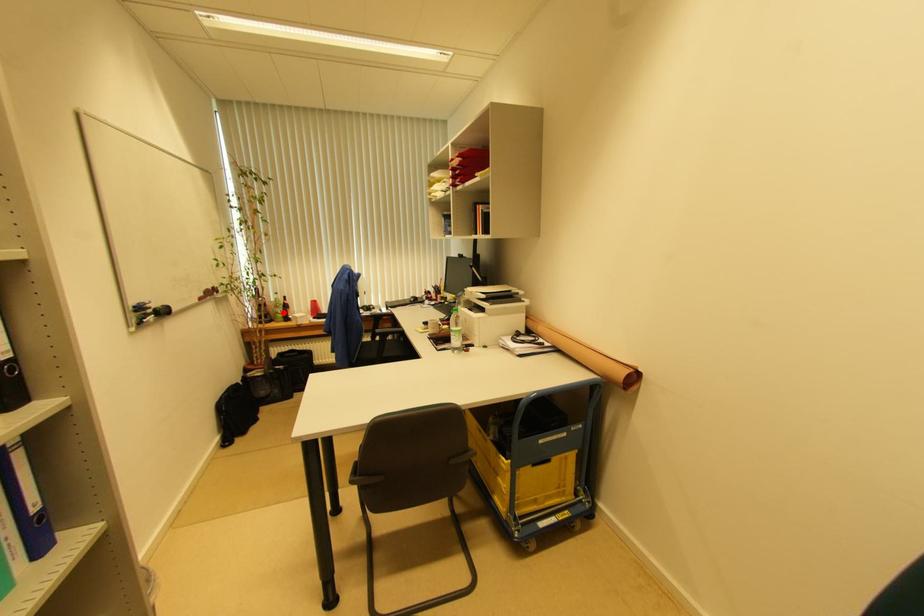
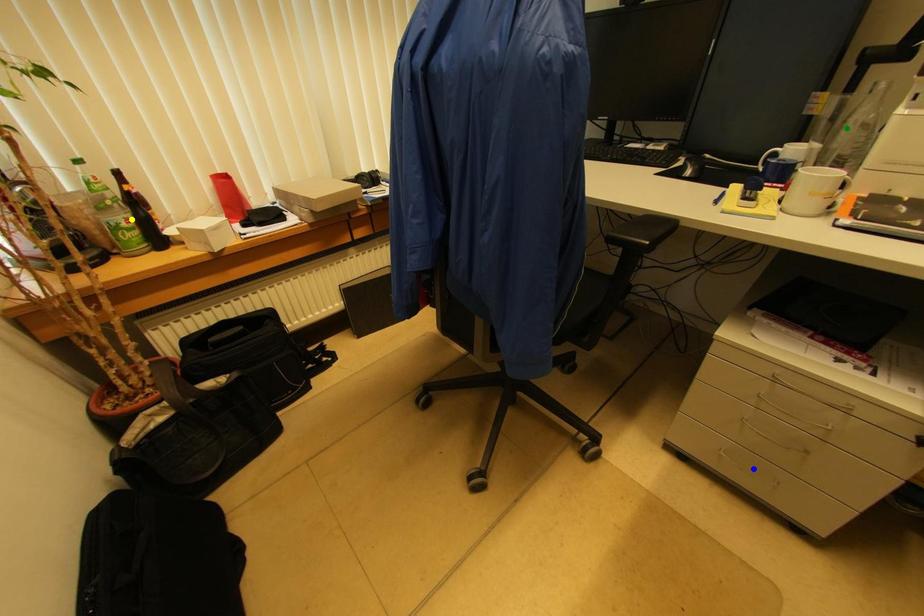
Question: I am providing you with two images of the same scene from different viewpoints. A red point is marked on the first image. You are given multiple points on the second image. Which mark in image 2 goes with the point in image 1?

Choices:
 (A) green point
 (B) blue point
 (C) yellow point

Answer: (C)